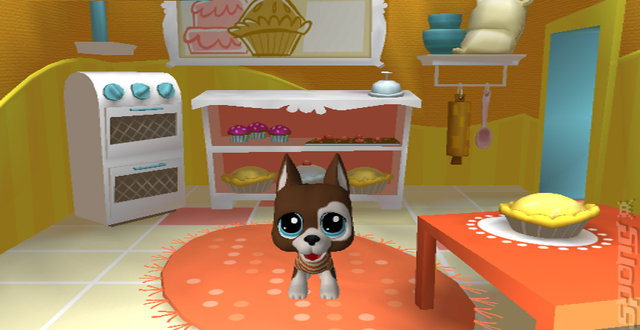
Where is `second knob on oven from the left`? This screenshot has height=330, width=640. second knob on oven from the left is located at coordinates (138, 89).